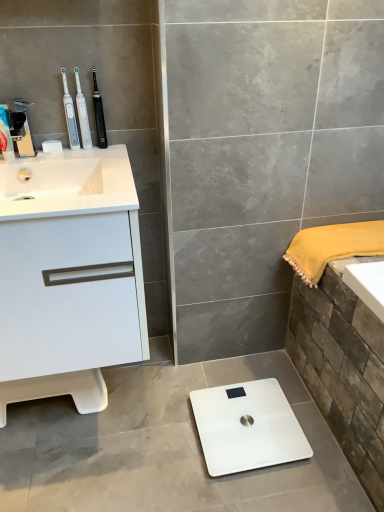
Where is `free spot above yellow fluffy towel at right (from a real-world perspective)`? The height and width of the screenshot is (512, 384). free spot above yellow fluffy towel at right (from a real-world perspective) is located at coordinates (348, 232).